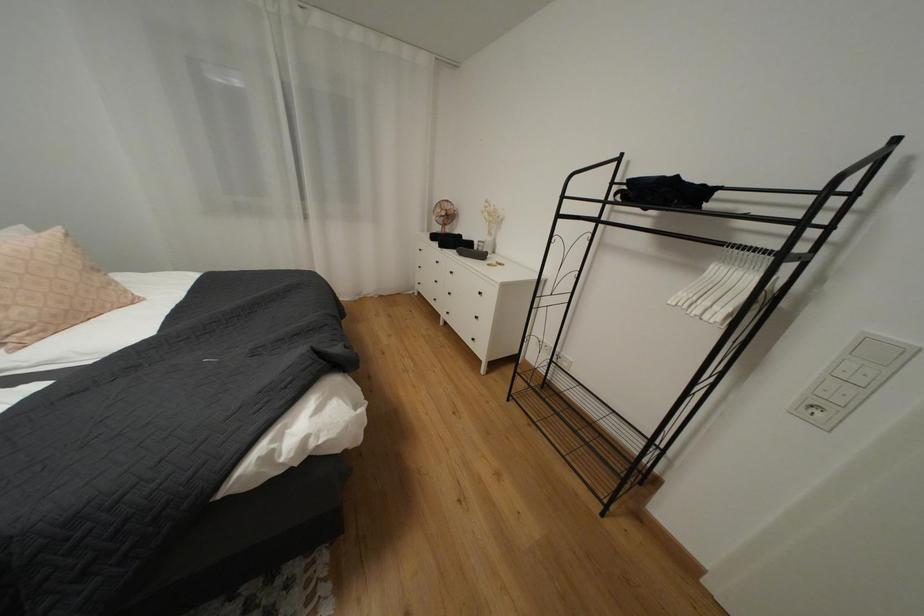
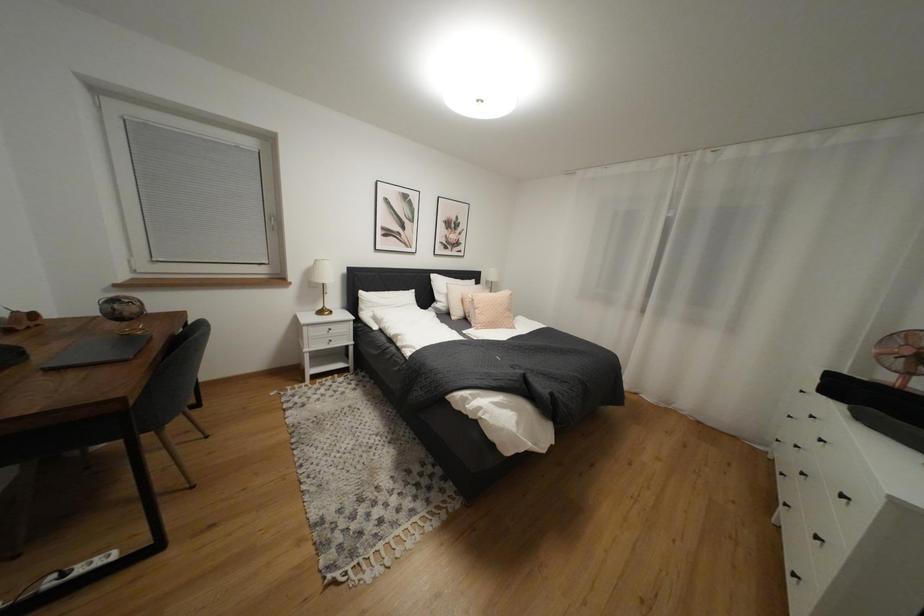
Question: How did the camera likely rotate?

Choices:
 (A) Left
 (B) Right
 (C) Up
 (D) Down

Answer: (A)